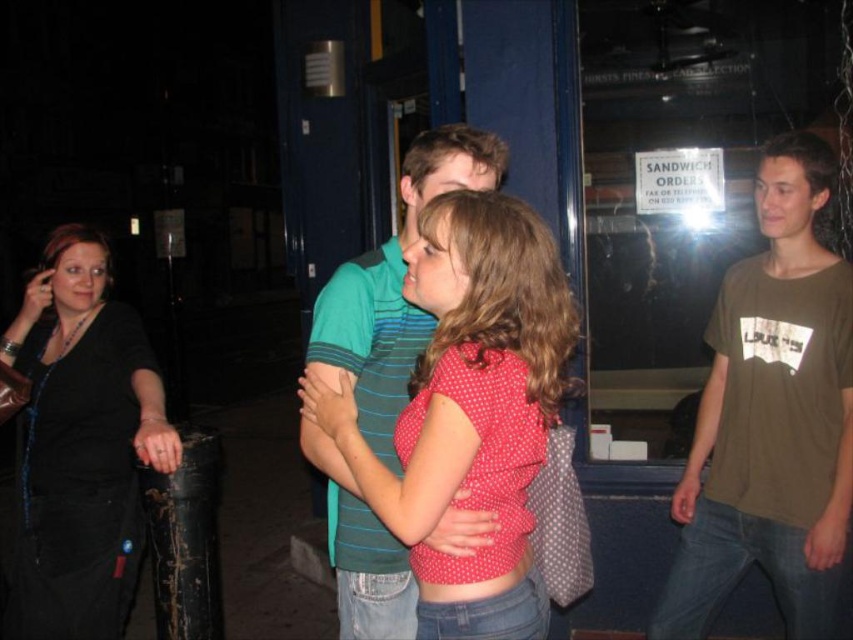
Question: Can you confirm if brown cotton t-shirt at right is bigger than black leather jacket at left?

Choices:
 (A) yes
 (B) no

Answer: (B)

Question: Which of the following is the closest to the observer?

Choices:
 (A) black leather jacket at left
 (B) brown cotton t-shirt at right
 (C) polka dot fabric shirt at center

Answer: (C)

Question: Does polka dot fabric shirt at center have a lesser width compared to black leather jacket at left?

Choices:
 (A) yes
 (B) no

Answer: (A)

Question: Which is nearer to the polka dot fabric shirt at center?

Choices:
 (A) black leather jacket at left
 (B) brown cotton t-shirt at right

Answer: (A)

Question: Can you confirm if polka dot fabric shirt at center is positioned to the left of black leather jacket at left?

Choices:
 (A) no
 (B) yes

Answer: (A)

Question: Which of these objects is positioned closest to the polka dot fabric shirt at center?

Choices:
 (A) black leather jacket at left
 (B) brown cotton t-shirt at right

Answer: (A)